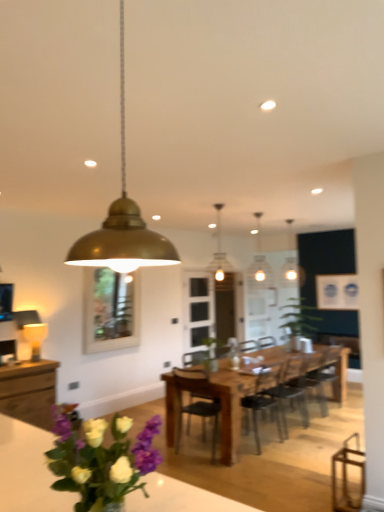
Question: Can you confirm if wooden dining table at center is positioned to the right of white glass pendant light at center, marked as the first lamp in a back-to-front arrangement?

Choices:
 (A) yes
 (B) no

Answer: (A)

Question: Is the position of wooden dining table at center less distant than that of white glass pendant light at center, which ranks as the 4th lamp in front-to-back order?

Choices:
 (A) yes
 (B) no

Answer: (A)

Question: Is wooden dining table at center facing away from white glass pendant light at center, the first lamp positioned from the right?

Choices:
 (A) no
 (B) yes

Answer: (A)

Question: Does wooden dining table at center have a greater height compared to white glass pendant light at center, marked as the first lamp in a back-to-front arrangement?

Choices:
 (A) no
 (B) yes

Answer: (A)

Question: Can you confirm if wooden dining table at center is positioned to the left of white glass pendant light at center, which ranks as the 4th lamp in front-to-back order?

Choices:
 (A) yes
 (B) no

Answer: (B)

Question: Considering the positions of matte gold pendant light at center, which is counted as the 2th lamp, starting from the right, and clear glass door at center in the image, is matte gold pendant light at center, which is counted as the 2th lamp, starting from the right, bigger or smaller than clear glass door at center?

Choices:
 (A) big
 (B) small

Answer: (A)

Question: From a real-world perspective, relative to clear glass door at center, is matte gold pendant light at center, the 3th lamp positioned from the back, vertically above or below?

Choices:
 (A) above
 (B) below

Answer: (A)

Question: Does point (220, 247) appear closer or farther from the camera than point (211, 293)?

Choices:
 (A) closer
 (B) farther

Answer: (B)

Question: Looking at their shapes, would you say matte gold pendant light at center, the 3th lamp positioned from the back, is wider or thinner than clear glass door at center?

Choices:
 (A) wide
 (B) thin

Answer: (A)

Question: Considering the positions of point (324, 396) and point (198, 375), is point (324, 396) closer or farther from the camera than point (198, 375)?

Choices:
 (A) closer
 (B) farther

Answer: (B)

Question: Considering the positions of wooden chair at center, the 4th chair from the left, and wooden chair at center, positioned as the 5th chair in right-to-left order, in the image, is wooden chair at center, the 4th chair from the left, wider or thinner than wooden chair at center, positioned as the 5th chair in right-to-left order,?

Choices:
 (A) wide
 (B) thin

Answer: (A)

Question: Based on their sizes in the image, would you say wooden chair at center, which is counted as the 2th chair, starting from the right, is bigger or smaller than wooden chair at center, placed as the first chair when sorted from left to right?

Choices:
 (A) small
 (B) big

Answer: (A)

Question: Considering the relative positions of wooden chair at center, the 4th chair from the left, and wooden chair at center, placed as the first chair when sorted from left to right, in the image provided, is wooden chair at center, the 4th chair from the left, to the left or to the right of wooden chair at center, placed as the first chair when sorted from left to right,?

Choices:
 (A) right
 (B) left

Answer: (A)

Question: From the image's perspective, is green matte plant at center located above or below wooden chair at center, placed as the first chair when sorted from left to right?

Choices:
 (A) above
 (B) below

Answer: (A)

Question: Considering the positions of green matte plant at center and wooden chair at center, positioned as the 5th chair in right-to-left order, in the image, is green matte plant at center wider or thinner than wooden chair at center, positioned as the 5th chair in right-to-left order,?

Choices:
 (A) wide
 (B) thin

Answer: (A)